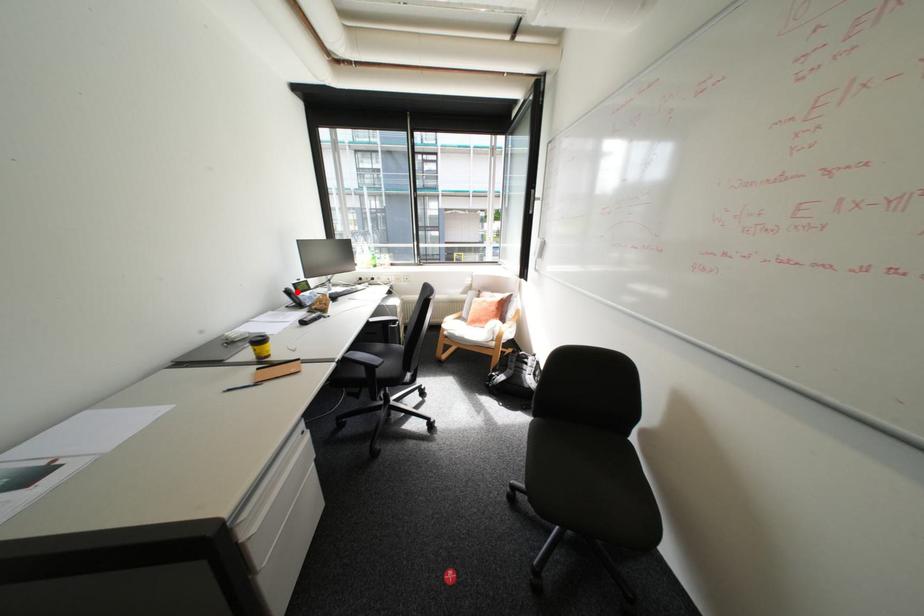
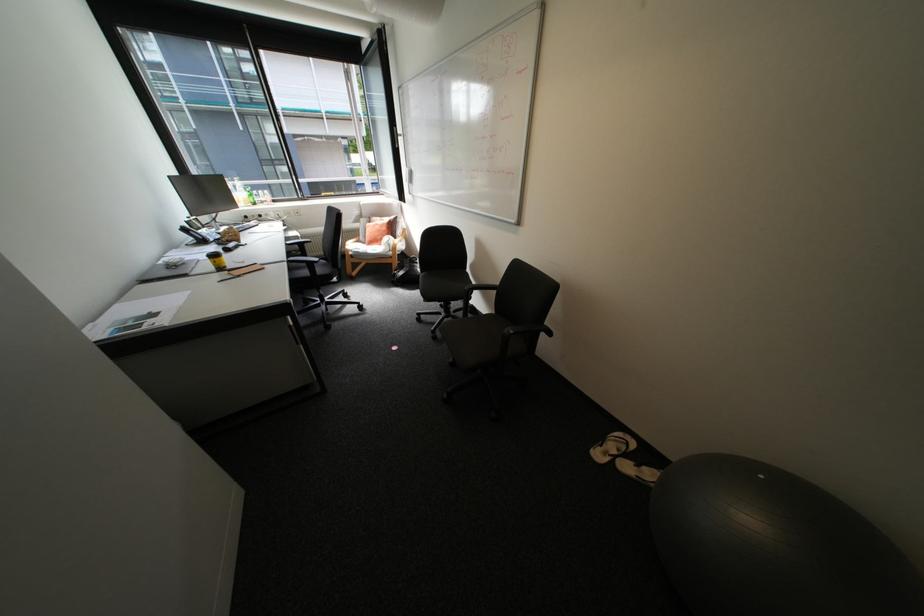
Find the pixel in the second image that matches the highlighted location in the first image.

(195, 230)